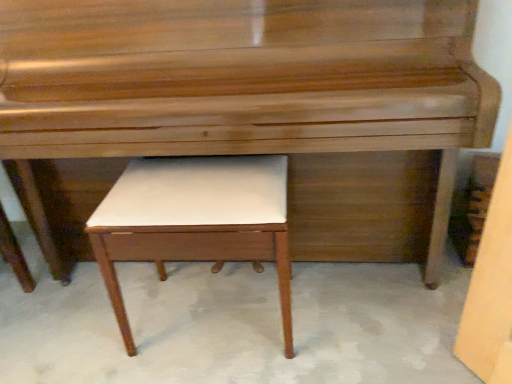
Image resolution: width=512 pixels, height=384 pixels. I want to click on free region on the left part of white leather stool at center, so click(x=91, y=326).